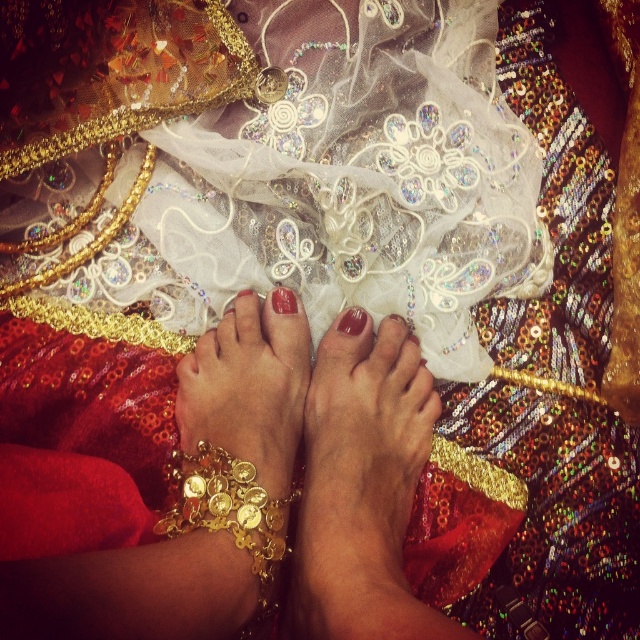
Question: Is gold metallic chain at lower left positioned in front of matte gold toe at center?

Choices:
 (A) yes
 (B) no

Answer: (A)

Question: Which point is closer to the camera?

Choices:
 (A) (342, 314)
 (B) (346, 356)
 (C) (230, 529)
 (D) (276, 308)

Answer: (C)

Question: Among these objects, which one is farthest from the camera?

Choices:
 (A) gold metallic chain at lower left
 (B) satin skin at center
 (C) matte gold toe at center
 (D) glossy nail polish at center

Answer: (C)

Question: Does satin skin at center have a lesser width compared to gold metallic chain at lower left?

Choices:
 (A) no
 (B) yes

Answer: (A)

Question: Is gold metallic chain at lower left to the right of matte gold toe at center from the viewer's perspective?

Choices:
 (A) no
 (B) yes

Answer: (A)

Question: Which object is farther from the camera taking this photo?

Choices:
 (A) matte gold toe at center
 (B) satin skin at center

Answer: (A)